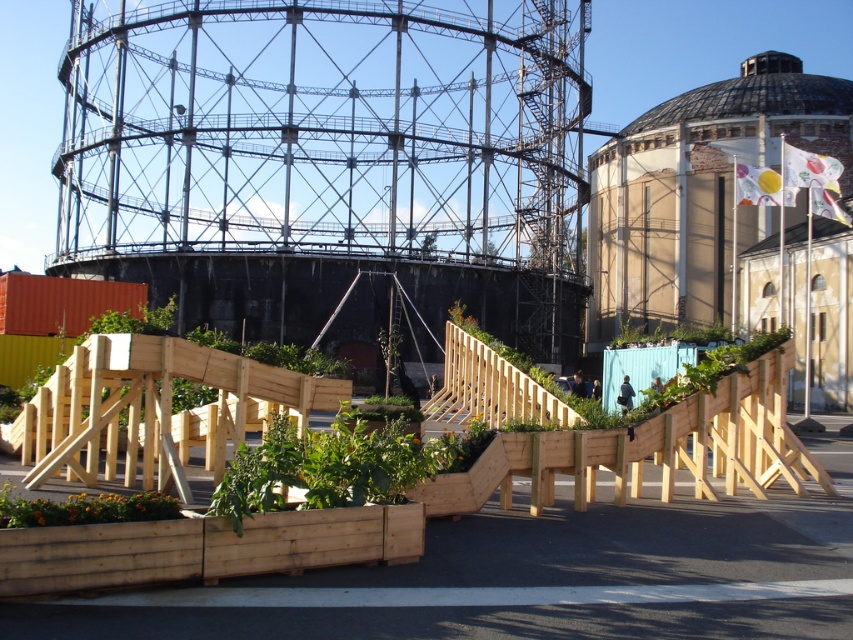
Question: Among these points, which one is farthest from the camera?

Choices:
 (A) (90, 513)
 (B) (283, 465)

Answer: (B)

Question: Is green wooden planter at center below wooden planter at lower left?

Choices:
 (A) yes
 (B) no

Answer: (B)

Question: Which of the following is the farthest from the observer?

Choices:
 (A) wooden planter at lower left
 (B) green wooden planter at center

Answer: (B)

Question: Does green wooden planter at center have a greater width compared to wooden planter at lower left?

Choices:
 (A) no
 (B) yes

Answer: (A)

Question: Which point is closer to the camera taking this photo?

Choices:
 (A) (294, 438)
 (B) (167, 499)

Answer: (B)

Question: From the image, what is the correct spatial relationship of green wooden planter at center in relation to wooden planter at lower left?

Choices:
 (A) below
 (B) above

Answer: (B)